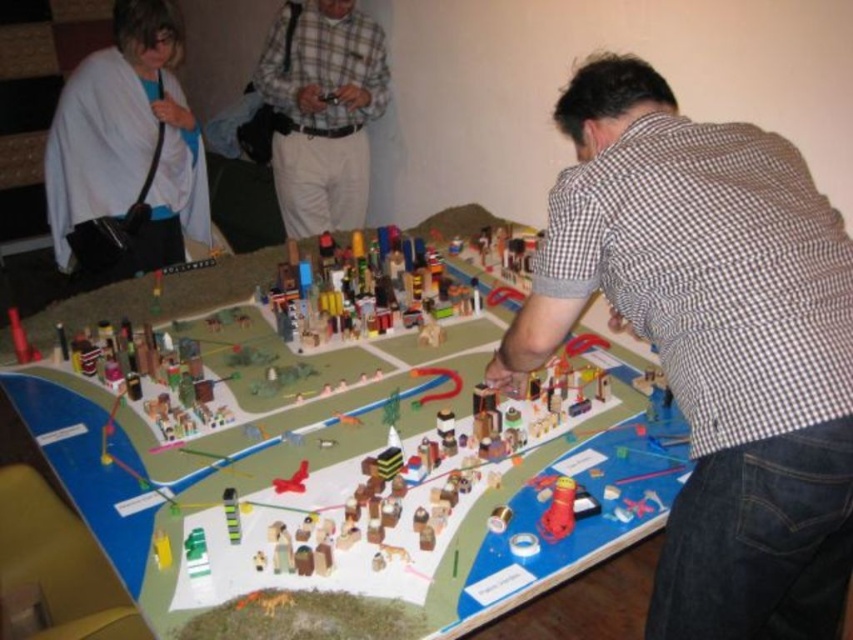
Which is more to the left, wooden cityscape at center or brown checkered shirt at center?

From the viewer's perspective, wooden cityscape at center appears more on the left side.

Is wooden cityscape at center above brown checkered shirt at center?

Incorrect, wooden cityscape at center is not positioned above brown checkered shirt at center.

Where is `wooden cityscape at center`? The height and width of the screenshot is (640, 853). wooden cityscape at center is located at coordinates (341, 483).

Does wooden cityscape at center appear over plaid fabric shirt at center?

Incorrect, wooden cityscape at center is not positioned above plaid fabric shirt at center.

Who is shorter, wooden cityscape at center or plaid fabric shirt at center?

Standing shorter between the two is wooden cityscape at center.

Image resolution: width=853 pixels, height=640 pixels. What do you see at coordinates (341, 483) in the screenshot? I see `wooden cityscape at center` at bounding box center [341, 483].

This screenshot has height=640, width=853. I want to click on wooden cityscape at center, so click(x=341, y=483).

Is point (281, 452) more distant than point (56, 113)?

No, it is not.

Which of these two, wooden cityscape at center or white fabric at upper left, stands shorter?

wooden cityscape at center

Which is behind, point (206, 442) or point (132, 243)?

The point (132, 243) is behind.

Image resolution: width=853 pixels, height=640 pixels. In order to click on wooden cityscape at center in this screenshot , I will do `click(341, 483)`.